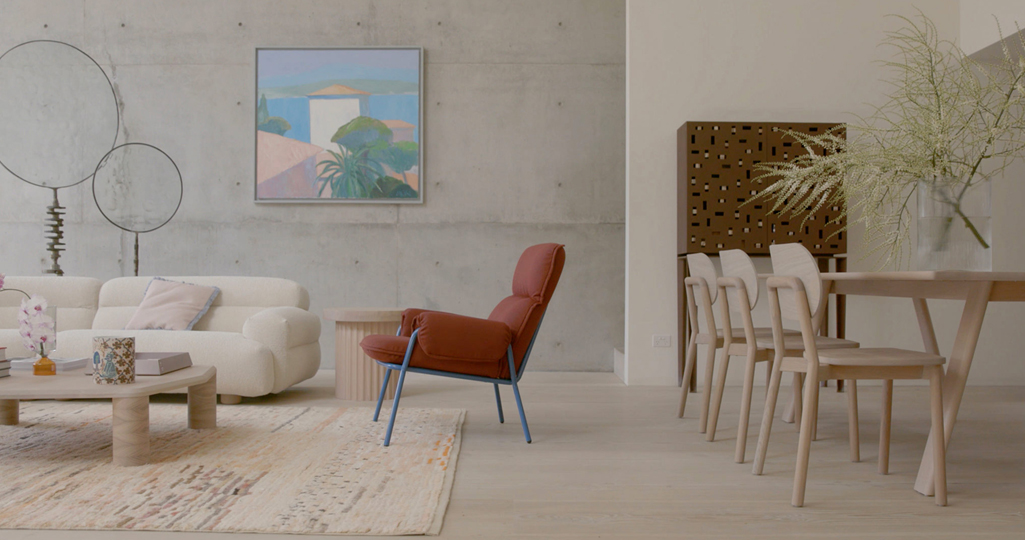
I want to click on blue chair legs, so click(380, 389), click(394, 395), click(493, 392), click(518, 407).